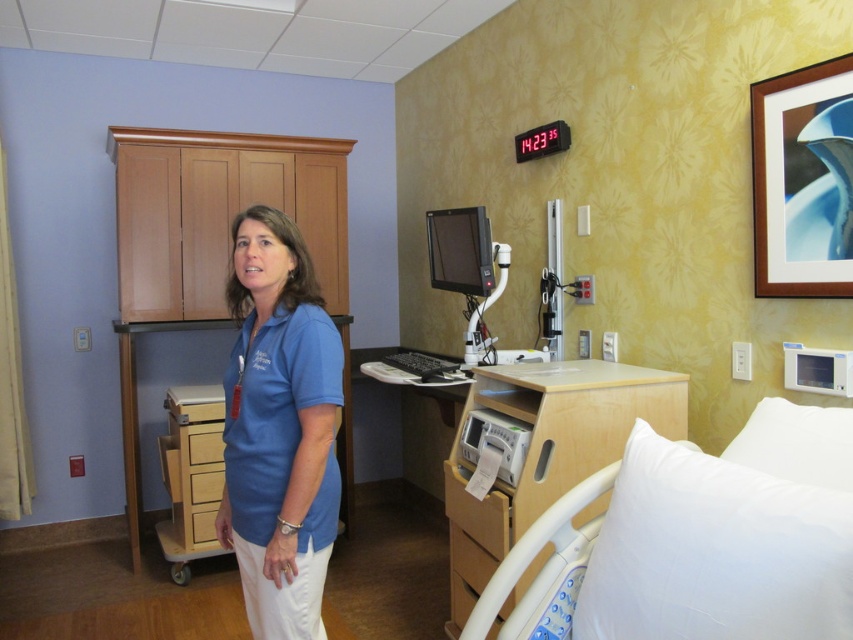
You are a nurse entering the hospital room and see the blue cotton shirt at center and the white soft hospital bed at lower right. Which object is located to the left of the other?

The blue cotton shirt at center is positioned on the left side of white soft hospital bed at lower right.

You are a nurse in the hospital room. You need to place a new patient chart on the bedside cabinet to the right of the bed. Where exactly should you place the chart so it doesn not overlap with the blue cotton shirt at center?

The blue cotton shirt at center is located at point (279, 428). To avoid overlapping, place the patient chart on the bedside cabinet to the right of the bed at a position that does not coincide with these coordinates.

You are a nurse in the hospital room. You need to find the point at coordinate (279,428). Where is this point located?

The point at coordinate (279,428) is located on the blue cotton shirt at center.